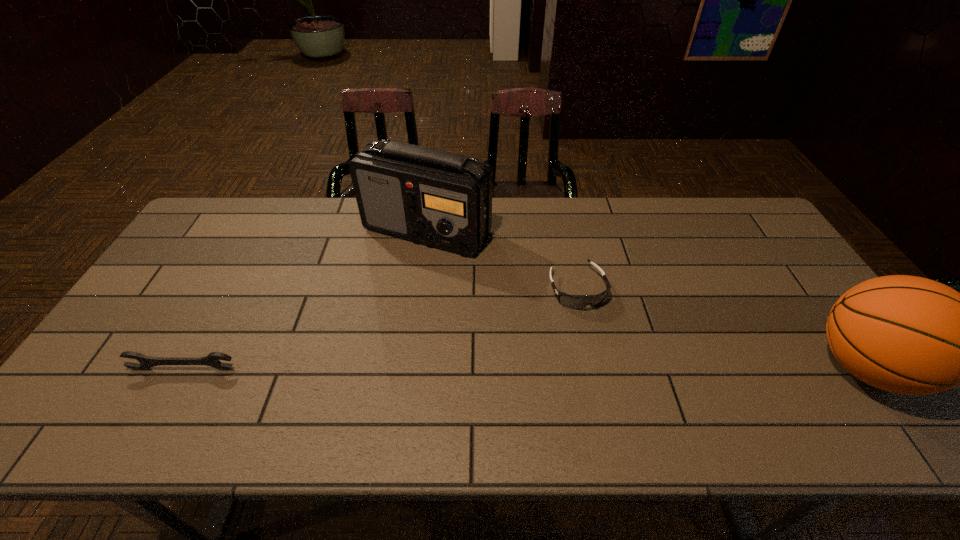
Find the location of a particular element. the leftmost object is located at coordinates (213, 359).

Find the location of a particular element. Image resolution: width=960 pixels, height=540 pixels. the second farthest object is located at coordinates point(575,302).

Locate an element on the screen. Image resolution: width=960 pixels, height=540 pixels. the shortest object is located at coordinates (575, 302).

Where is `the third object from right to left`? the third object from right to left is located at coordinates (437, 198).

At what (x,y) coordinates should I click in order to perform the action: click on the farthest object. Please return your answer as a coordinate pair (x, y). The width and height of the screenshot is (960, 540). Looking at the image, I should click on (437, 198).

At what (x,y) coordinates should I click in order to perform the action: click on vacant space positioned on the open ends of the wrench. Please return your answer as a coordinate pair (x, y). Looking at the image, I should click on (170, 393).

Locate an element on the screen. The height and width of the screenshot is (540, 960). vacant region located on the front and sides of the shortest object is located at coordinates (610, 360).

Locate an element on the screen. vacant area situated 0.210m on the front and sides of the shortest object is located at coordinates pyautogui.click(x=617, y=377).

What are the coordinates of `free space located on the front and sides of the shortest object` in the screenshot? It's located at (616, 373).

Where is `free space located on the front panel of the radio receiver`? The image size is (960, 540). free space located on the front panel of the radio receiver is located at coordinates (435, 305).